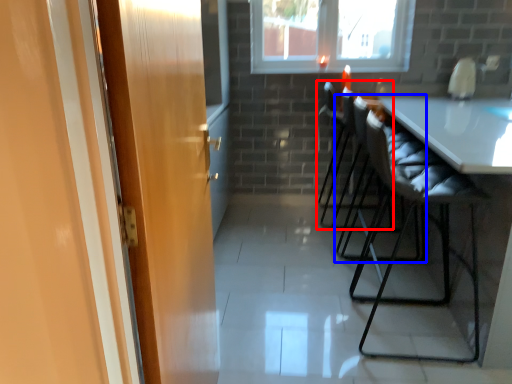
Question: Among these objects, which one is nearest to the camera, chair (highlighted by a red box) or chair (highlighted by a blue box)?

Choices:
 (A) chair
 (B) chair

Answer: (B)